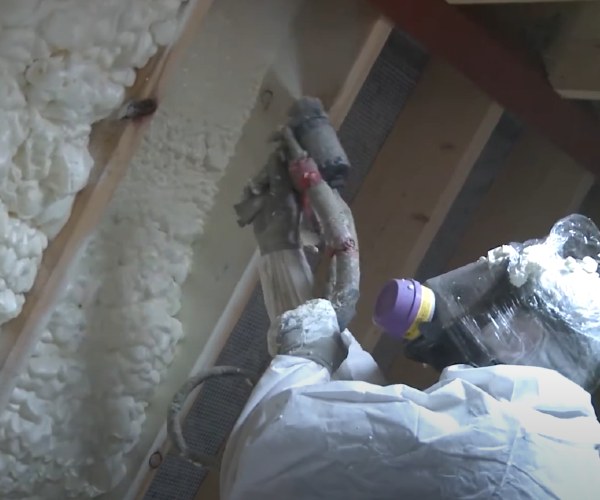
The image size is (600, 500). Find the location of `foam`. foam is located at coordinates (192, 162).